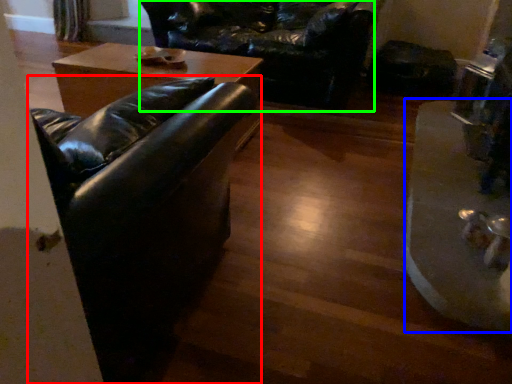
Question: Which object is positioned farthest from studio couch (highlighted by a red box)? Select from wide (highlighted by a blue box) and swivel chair (highlighted by a green box).

Choices:
 (A) wide
 (B) swivel chair

Answer: (B)